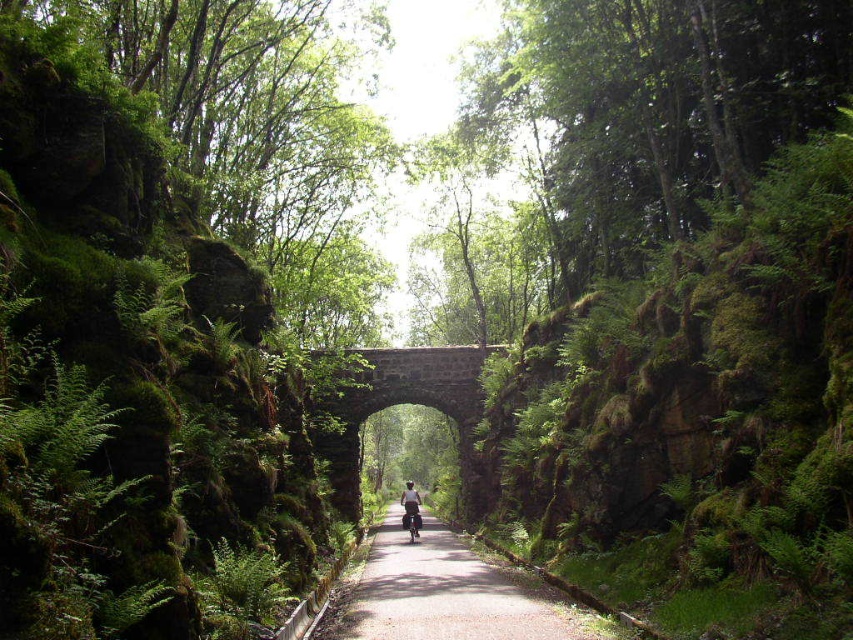
Question: Which of the following is the farthest from the observer?

Choices:
 (A) smooth asphalt path at center
 (B) metallic silver motorbike at center
 (C) stone archway at center

Answer: (C)

Question: In this image, where is smooth asphalt path at center located relative to stone archway at center?

Choices:
 (A) right
 (B) left

Answer: (A)

Question: Which object appears farthest from the camera in this image?

Choices:
 (A) stone archway at center
 (B) smooth asphalt path at center
 (C) metallic silver motorbike at center

Answer: (A)

Question: Among these points, which one is farthest from the camera?

Choices:
 (A) (550, 589)
 (B) (473, 420)

Answer: (B)

Question: Can you confirm if smooth asphalt path at center is smaller than metallic silver motorbike at center?

Choices:
 (A) yes
 (B) no

Answer: (B)

Question: Does stone archway at center appear under metallic silver motorbike at center?

Choices:
 (A) yes
 (B) no

Answer: (B)